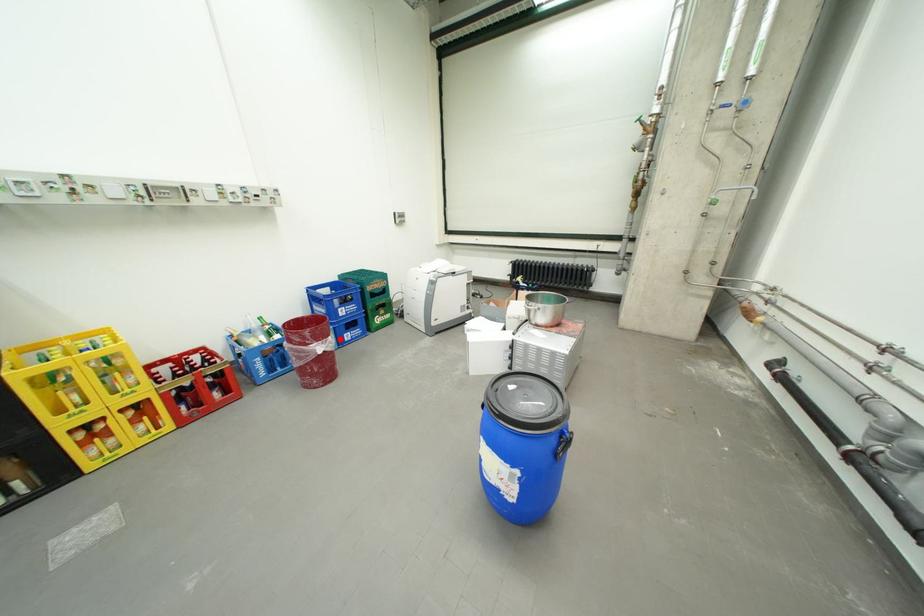
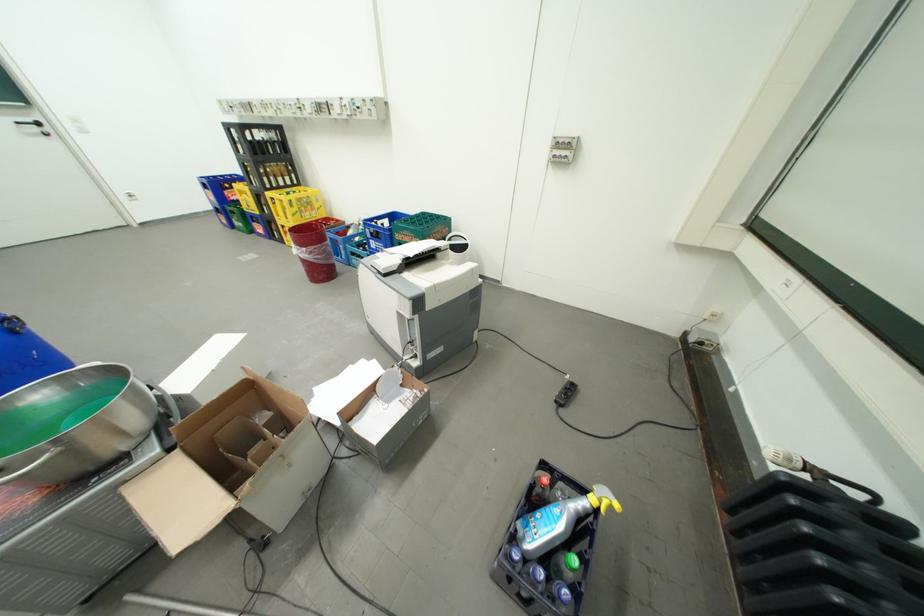
In the second image, find the point that corresponds to the highlighted location in the first image.

(314, 249)